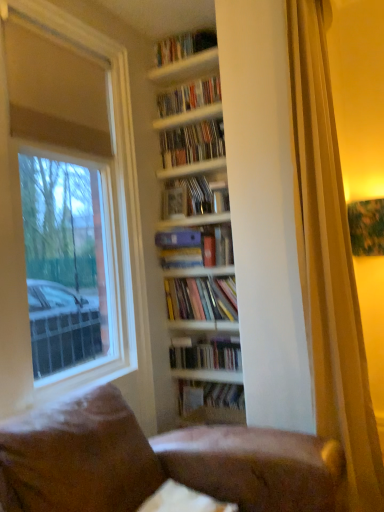
Identify the location of white matte window at left. The height and width of the screenshot is (512, 384). (63, 208).

Looking at this image, what is the approximate width of white glossy bookshelf at upper center, the second book viewed from the top?

It is 5.69 inches.

In order to face hardcover books at center, placed as the seventh book when sorted from top to bottom, should I rotate leftwards or rightwards?

To align with it, rotate right about 2.045°.

The height and width of the screenshot is (512, 384). What do you see at coordinates (194, 197) in the screenshot?
I see `matte plastic bookshelf at center, the 4th book viewed from the top` at bounding box center [194, 197].

I want to click on hardcover book at center, so click(174, 202).

Which is less distant, (201, 56) or (168, 189)?

Positioned in front is point (201, 56).

Is the surface of white glossy shelves at upper center, the 1th shelf from the top, in direct contact with matte plastic bookshelf at center, which is the fifth book in bottom-to-top order?

No, white glossy shelves at upper center, the 1th shelf from the top, is not with matte plastic bookshelf at center, which is the fifth book in bottom-to-top order.

Between white glossy shelves at upper center, which is the second shelf from bottom to top, and matte plastic bookshelf at center, which is the fifth book in bottom-to-top order, which one appears on the right side from the viewer's perspective?

matte plastic bookshelf at center, which is the fifth book in bottom-to-top order, is more to the right.

Is white glossy shelves at upper center, the 1th shelf from the top, behind matte plastic bookshelf at center, which is the fifth book in bottom-to-top order?

That is False.

Based on the photo, looking at their sizes, would you say white glossy shelves at upper center, the 1th shelf from the top, is wider or thinner than hardcover books at upper center, the eighth book from the bottom?

white glossy shelves at upper center, the 1th shelf from the top, is wider than hardcover books at upper center, the eighth book from the bottom.

Is point (216, 47) positioned in front of point (159, 56)?

Yes, point (216, 47) is closer to viewer.

From the picture: From the image's perspective, relative to hardcover books at upper center, which is the first book in top-to-bottom order, is white glossy shelves at upper center, the 1th shelf from the top, above or below?

white glossy shelves at upper center, the 1th shelf from the top, is situated lower than hardcover books at upper center, which is the first book in top-to-bottom order, in the image.

Is white glossy shelves at upper center, the 1th shelf from the top, situated inside hardcover books at upper center, the eighth book from the bottom, or outside?

white glossy shelves at upper center, the 1th shelf from the top, lies outside hardcover books at upper center, the eighth book from the bottom.

Would you say matte blue folder at center, the 5th book from the top, is inside or outside hardcover book at center, arranged as the 8th book when viewed from the top?

matte blue folder at center, the 5th book from the top, is outside hardcover book at center, arranged as the 8th book when viewed from the top.

In terms of size, does matte blue folder at center, which appears as the fourth book when ordered from the bottom, appear bigger or smaller than hardcover book at center, arranged as the 8th book when viewed from the top?

In the image, matte blue folder at center, which appears as the fourth book when ordered from the bottom, appears to be larger than hardcover book at center, arranged as the 8th book when viewed from the top.

From the image's perspective, between matte blue folder at center, the 5th book from the top, and hardcover book at center, which is the 1th book in bottom-to-top order, which one is located above?

From the image's view, matte blue folder at center, the 5th book from the top, is above.

Would you say matte plastic bookshelf at center, the 4th book viewed from the top, is inside or outside matte blue folder at center, the 5th book from the top?

matte plastic bookshelf at center, the 4th book viewed from the top, cannot be found inside matte blue folder at center, the 5th book from the top.

Is matte plastic bookshelf at center, which is the fifth book in bottom-to-top order, turned away from matte blue folder at center, the 5th book from the top?

matte plastic bookshelf at center, which is the fifth book in bottom-to-top order, does not have its back to matte blue folder at center, the 5th book from the top.

There is a matte plastic bookshelf at center, the 4th book viewed from the top. At what (x,y) coordinates should I click in order to perform the action: click on the 1st book below it (from the image's perspective). Please return your answer as a coordinate pair (x, y). Looking at the image, I should click on (195, 247).

Is matte plastic bookshelf at center, which is the fifth book in bottom-to-top order, beside matte blue folder at center, the 5th book from the top?

No, matte plastic bookshelf at center, which is the fifth book in bottom-to-top order, is not next to matte blue folder at center, the 5th book from the top.

Based on the photo, from the image's perspective, is wooden shelves at upper center, the 1th shelf ordered from the bottom, located above or below matte blue folder at center, the 5th book from the top?

wooden shelves at upper center, the 1th shelf ordered from the bottom, is situated higher than matte blue folder at center, the 5th book from the top, in the image.

Which object is closer to the camera taking this photo, wooden shelves at upper center, which is the 2th shelf in top-to-bottom order, or matte blue folder at center, the 5th book from the top?

matte blue folder at center, the 5th book from the top, is closer to the camera.

Can you confirm if wooden shelves at upper center, the 1th shelf ordered from the bottom, is wider than matte blue folder at center, the 5th book from the top?

Incorrect, the width of wooden shelves at upper center, the 1th shelf ordered from the bottom, does not surpass that of matte blue folder at center, the 5th book from the top.

Is wooden shelves at upper center, the 1th shelf ordered from the bottom, positioned far away from matte blue folder at center, which appears as the fourth book when ordered from the bottom?

No, wooden shelves at upper center, the 1th shelf ordered from the bottom, is not far away from matte blue folder at center, which appears as the fourth book when ordered from the bottom.

Is hardcover books at center, positioned as the 3th book in bottom-to-top order, to the left of matte plastic bookshelf at center, the 4th book viewed from the top, from the viewer's perspective?

No.

Does hardcover books at center, the 6th book positioned from the top, have a smaller size compared to matte plastic bookshelf at center, the 4th book viewed from the top?

Incorrect, hardcover books at center, the 6th book positioned from the top, is not smaller in size than matte plastic bookshelf at center, the 4th book viewed from the top.

From the image's perspective, who appears lower, hardcover books at center, positioned as the 3th book in bottom-to-top order, or matte plastic bookshelf at center, the 4th book viewed from the top?

hardcover books at center, positioned as the 3th book in bottom-to-top order, is shown below in the image.

Is hardcover books at center, positioned as the 3th book in bottom-to-top order, outside of matte plastic bookshelf at center, the 4th book viewed from the top?

Yes, hardcover books at center, positioned as the 3th book in bottom-to-top order, is outside of matte plastic bookshelf at center, the 4th book viewed from the top.

Is brown leather couch at lower center in front of or behind hardcover book at center in the image?

brown leather couch at lower center is in front of hardcover book at center.

Can you confirm if brown leather couch at lower center is positioned to the right of hardcover book at center?

Correct, you'll find brown leather couch at lower center to the right of hardcover book at center.

What's the angular difference between brown leather couch at lower center and hardcover book at center's facing directions?

There is a 83.4-degree angle between the facing directions of brown leather couch at lower center and hardcover book at center.

Are brown leather couch at lower center and hardcover book at center located far from each other?

Yes, brown leather couch at lower center is far from hardcover book at center.

From the white glossy shelves at upper center, which is the second shelf from bottom to top, count 4th book to the right and point to it. Please provide its 2D coordinates.

[(194, 197)]

This screenshot has width=384, height=512. Find the location of `book above the white glossy shelves at upper center, the 1th shelf from the top (from the image's perspective)`. book above the white glossy shelves at upper center, the 1th shelf from the top (from the image's perspective) is located at coordinates (184, 46).

Considering their positions, is matte plastic books at upper center, placed as the 6th book when sorted from bottom to top, positioned further to white glossy bookshelf at upper center, the seventh book positioned from the bottom, than wooden shelves at upper center, which is the 2th shelf in top-to-bottom order?

matte plastic books at upper center, placed as the 6th book when sorted from bottom to top, is further to white glossy bookshelf at upper center, the seventh book positioned from the bottom.

In the scene shown: Which object lies nearer to the anchor point brown leather couch at lower center, hardcover books at center, placed as the 2th book when sorted from bottom to top, or matte plastic books at upper center, which appears as the third book when viewed from the top?

The object closer to brown leather couch at lower center is hardcover books at center, placed as the 2th book when sorted from bottom to top.

Looking at the image, which one is located closer to white glossy bookshelf at upper center, the second book viewed from the top, matte plastic bookshelf at center, which is the fifth book in bottom-to-top order, or matte plastic books at upper center, placed as the 6th book when sorted from bottom to top?

matte plastic books at upper center, placed as the 6th book when sorted from bottom to top, is positioned closer to the anchor white glossy bookshelf at upper center, the second book viewed from the top.

From the picture: Which object lies further to the anchor point wooden shelves at upper center, the 1th shelf ordered from the bottom, hardcover books at center, the 6th book positioned from the top, or matte plastic books at upper center, placed as the 6th book when sorted from bottom to top?

hardcover books at center, the 6th book positioned from the top, is further to wooden shelves at upper center, the 1th shelf ordered from the bottom.

Considering their positions, is hardcover books at upper center, the eighth book from the bottom, positioned closer to wooden shelves at upper center, the 1th shelf ordered from the bottom, than matte plastic bookshelf at center, the 4th book viewed from the top?

The object closer to wooden shelves at upper center, the 1th shelf ordered from the bottom, is hardcover books at upper center, the eighth book from the bottom.

When comparing their distances from brown leather couch at lower center, does matte plastic books at upper center, which appears as the third book when viewed from the top, or white glossy shelves at upper center, the 1th shelf from the top, seem further?

The object further to brown leather couch at lower center is white glossy shelves at upper center, the 1th shelf from the top.

Estimate the real-world distances between objects in this image. Which object is closer to brown leather couch at lower center, hardcover book at center or white glossy bookshelf at upper center, the seventh book positioned from the bottom?

Based on the image, hardcover book at center appears to be nearer to brown leather couch at lower center.

Looking at the image, which one is located further to hardcover books at upper center, which is the first book in top-to-bottom order, matte plastic bookshelf at center, which is the fifth book in bottom-to-top order, or white glossy shelves at upper center, which is the second shelf from bottom to top?

The object further to hardcover books at upper center, which is the first book in top-to-bottom order, is matte plastic bookshelf at center, which is the fifth book in bottom-to-top order.

Where is `book between white glossy shelves at upper center, the 1th shelf from the top, and matte plastic books at upper center, which appears as the third book when viewed from the top, in the vertical direction`? This screenshot has height=512, width=384. book between white glossy shelves at upper center, the 1th shelf from the top, and matte plastic books at upper center, which appears as the third book when viewed from the top, in the vertical direction is located at coordinates (189, 96).

Locate an element on the screen. This screenshot has width=384, height=512. shelf that lies between white glossy shelves at upper center, which is the second shelf from bottom to top, and matte plastic bookshelf at center, the 4th book viewed from the top, from top to bottom is located at coordinates (189, 117).

Identify the location of book between matte plastic books at upper center, placed as the 6th book when sorted from bottom to top, and hardcover book at center from top to bottom. The width and height of the screenshot is (384, 512). (194, 197).

You are a GUI agent. You are given a task and a screenshot of the screen. Output one action in this format:
    pyautogui.click(x=<x>, y=<y>)
    Task: Click on the shelf that lies between white glossy bookshelf at upper center, the second book viewed from the top, and hardcover book at center, which is the 1th book in bottom-to-top order, from top to bottom
    The image size is (384, 512).
    Given the screenshot: What is the action you would take?
    pyautogui.click(x=189, y=117)